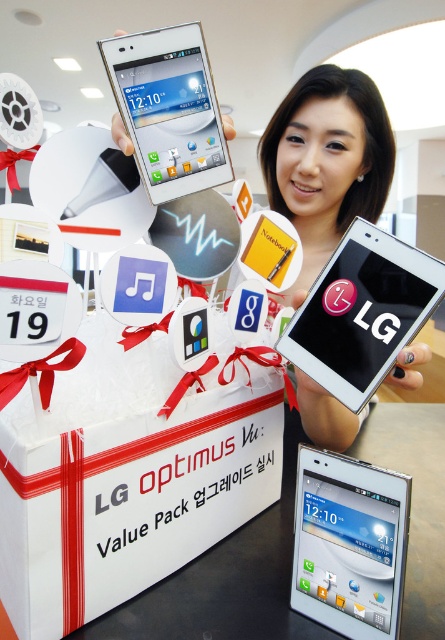
From the picture: Can you confirm if white cardboard box at center is bigger than white glossy phone at center?

Yes, white cardboard box at center is bigger than white glossy phone at center.

The width and height of the screenshot is (445, 640). In order to click on white cardboard box at center in this screenshot , I will do [126, 472].

Which is behind, point (296, 100) or point (168, 154)?

The point (296, 100) is behind.

Is point (278, 138) positioned after point (116, 97)?

Yes, point (278, 138) is behind point (116, 97).

Is point (352, 76) behind point (222, 147)?

Yes, it is behind point (222, 147).

Where is `smooth skin at center`? smooth skin at center is located at coordinates (327, 161).

Between white glossy smartphone at center and white glossy smartphone at upper center, which one appears on the right side from the viewer's perspective?

white glossy smartphone at center

Does point (308, 490) lie behind point (153, 58)?

Yes, it is behind point (153, 58).

Identify the location of white glossy smartphone at center. This screenshot has width=445, height=640. (350, 544).